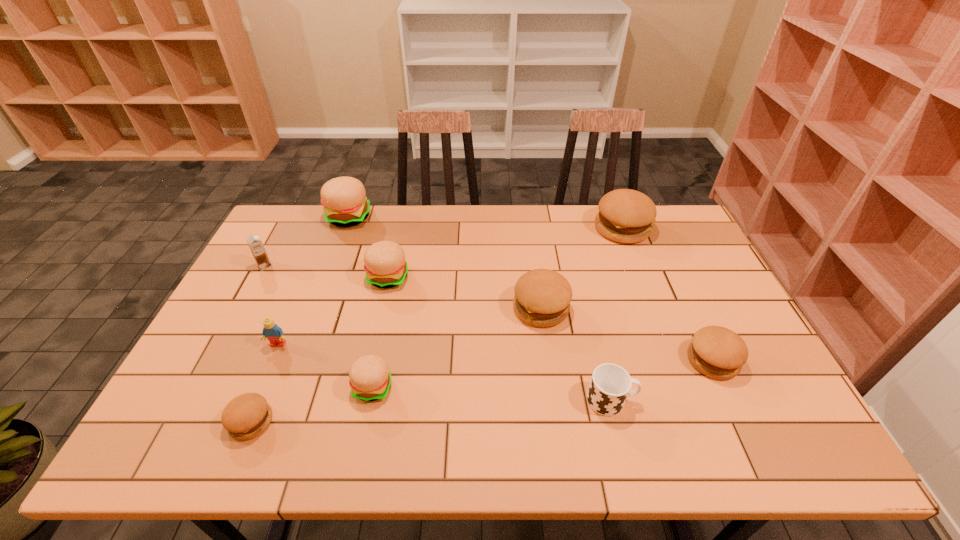
Locate an element on the screen. The height and width of the screenshot is (540, 960). free space between the leftmost object and the second nearest brown hamburger is located at coordinates click(489, 313).

Locate an element on the screen. This screenshot has height=540, width=960. unoccupied area between the black cup and the leftmost object is located at coordinates point(438,333).

Locate an element on the screen. This screenshot has width=960, height=540. free space that is in between the third hamburger from right to left and the third biggest brown hamburger is located at coordinates (627, 334).

Where is `empty space that is in between the smallest beige hamburger and the cup`? empty space that is in between the smallest beige hamburger and the cup is located at coordinates (492, 394).

Locate an element on the screen. The height and width of the screenshot is (540, 960). vacant area between the nearest brown hamburger and the blue Lego is located at coordinates (265, 383).

The width and height of the screenshot is (960, 540). What are the coordinates of `object that is the nearest to the black cup` in the screenshot? It's located at (717, 352).

Identify the location of object that is the second nearest to the second biggest brown hamburger. The height and width of the screenshot is (540, 960). (626, 216).

I want to click on hamburger identified as the closest to the second smallest brown hamburger, so point(542,298).

Point out which hamburger is positioned as the nearest to the second farthest beige hamburger. Please provide its 2D coordinates. Your answer should be formatted as a tuple, i.e. [(x, y)], where the tuple contains the x and y coordinates of a point satisfying the conditions above.

[(344, 199)]

The height and width of the screenshot is (540, 960). In order to click on beige hamburger that stands as the closest to the leftmost beige hamburger in this screenshot , I will do `click(384, 262)`.